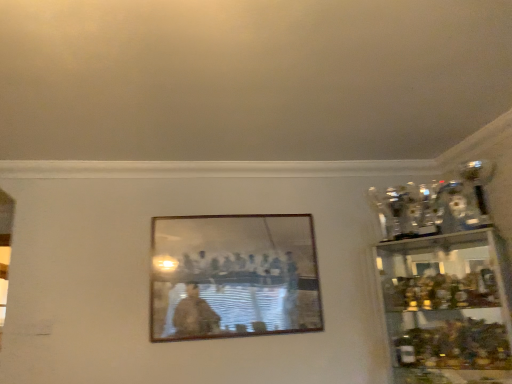
Question: From a real-world perspective, is wooden picture frame at center above or below clear glass cabinet at right?

Choices:
 (A) above
 (B) below

Answer: (A)

Question: Is wooden picture frame at center situated inside clear glass cabinet at right or outside?

Choices:
 (A) outside
 (B) inside

Answer: (A)

Question: Looking at the image, does wooden picture frame at center seem bigger or smaller compared to clear glass cabinet at right?

Choices:
 (A) big
 (B) small

Answer: (B)

Question: Is clear glass cabinet at right spatially inside wooden picture frame at center, or outside of it?

Choices:
 (A) inside
 (B) outside

Answer: (B)

Question: Considering the positions of point (490, 377) and point (312, 230), is point (490, 377) closer or farther from the camera than point (312, 230)?

Choices:
 (A) farther
 (B) closer

Answer: (B)

Question: Based on their sizes in the image, would you say clear glass cabinet at right is bigger or smaller than wooden picture frame at center?

Choices:
 (A) big
 (B) small

Answer: (A)

Question: Is clear glass cabinet at right to the left or to the right of wooden picture frame at center in the image?

Choices:
 (A) left
 (B) right

Answer: (B)